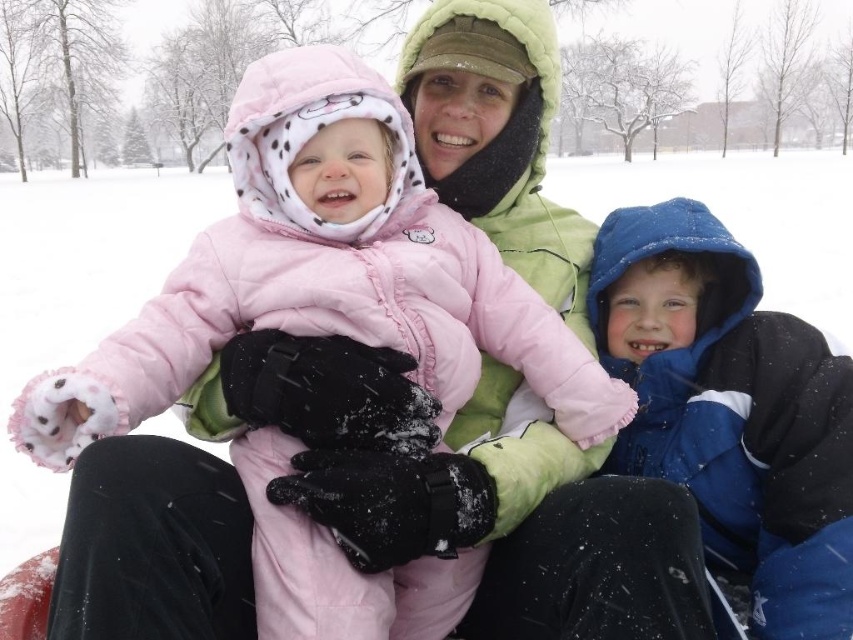
You are a GUI agent. You are given a task and a screenshot of the screen. Output one action in this format:
    pyautogui.click(x=<x>, y=<y>)
    Task: Click on the matte pink coat at center
    The width and height of the screenshot is (853, 640).
    Given the screenshot: What is the action you would take?
    pyautogui.click(x=323, y=273)

Measure the distance between matte pink coat at center and camera.

matte pink coat at center and camera are 1.11 meters apart from each other.

Find the location of a particular element. This screenshot has height=640, width=853. matte pink coat at center is located at coordinates (323, 273).